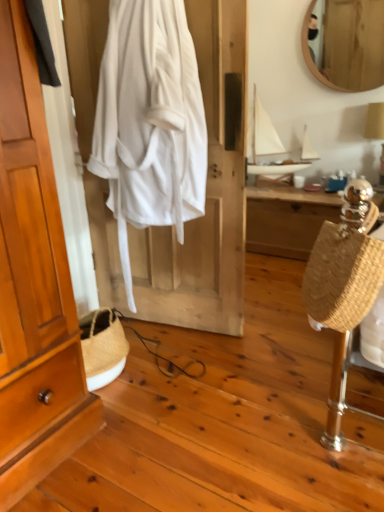
Question: Does wooden desk at center turn towards wooden wardrobe at left?

Choices:
 (A) yes
 (B) no

Answer: (B)

Question: Considering the relative sizes of wooden desk at center and wooden wardrobe at left in the image provided, is wooden desk at center bigger than wooden wardrobe at left?

Choices:
 (A) no
 (B) yes

Answer: (B)

Question: From the image's perspective, is wooden desk at center located beneath wooden wardrobe at left?

Choices:
 (A) yes
 (B) no

Answer: (A)

Question: Is wooden desk at center positioned far away from wooden wardrobe at left?

Choices:
 (A) yes
 (B) no

Answer: (A)

Question: Is wooden desk at center facing away from wooden wardrobe at left?

Choices:
 (A) yes
 (B) no

Answer: (B)

Question: Does wooden desk at center appear on the right side of wooden wardrobe at left?

Choices:
 (A) no
 (B) yes

Answer: (B)

Question: From a real-world perspective, is wooden desk at center over braided straw bag at right?

Choices:
 (A) no
 (B) yes

Answer: (A)

Question: Could you tell me if wooden desk at center is turned towards braided straw bag at right?

Choices:
 (A) no
 (B) yes

Answer: (B)

Question: Is wooden desk at center not close to braided straw bag at right?

Choices:
 (A) no
 (B) yes

Answer: (B)

Question: Considering the relative positions of wooden desk at center and braided straw bag at right in the image provided, is wooden desk at center to the right of braided straw bag at right from the viewer's perspective?

Choices:
 (A) yes
 (B) no

Answer: (A)

Question: From the image's perspective, is wooden desk at center over braided straw bag at right?

Choices:
 (A) yes
 (B) no

Answer: (A)

Question: Does wooden desk at center have a lesser height compared to braided straw bag at right?

Choices:
 (A) no
 (B) yes

Answer: (A)

Question: From the image's perspective, is wooden wardrobe at left on top of white matte sailboat at upper center?

Choices:
 (A) yes
 (B) no

Answer: (B)